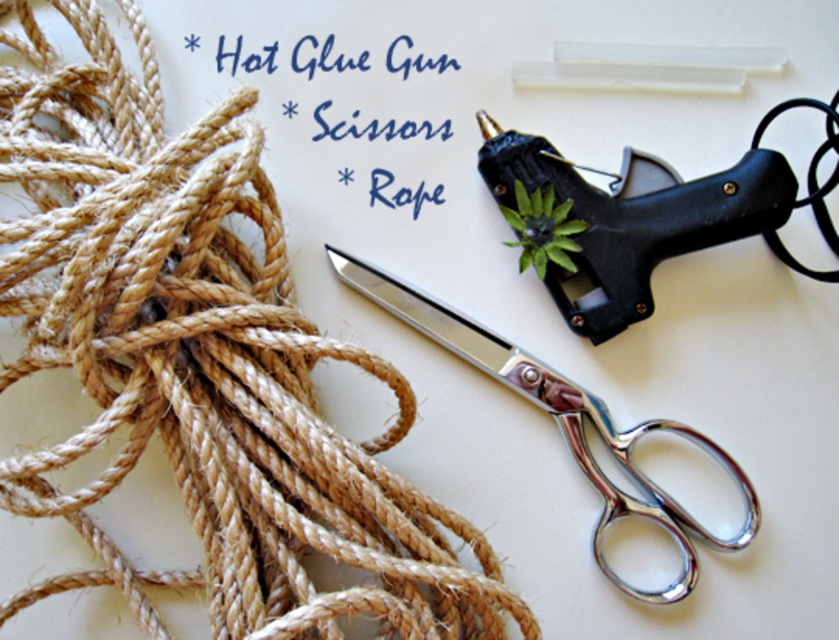
Question: Is polished metal scissors at center thinner than green leafy plant at upper center?

Choices:
 (A) no
 (B) yes

Answer: (A)

Question: From the image, what is the correct spatial relationship of matte black hot glue gun at upper right in relation to green leafy plant at upper center?

Choices:
 (A) left
 (B) right

Answer: (A)

Question: Is black plastic hot glue gun at upper right below matte black hot glue gun at upper right?

Choices:
 (A) yes
 (B) no

Answer: (A)

Question: Which point is closer to the camera taking this photo?

Choices:
 (A) (404, 72)
 (B) (576, 227)

Answer: (B)

Question: Which of these objects is positioned farthest from the black plastic hot glue gun at upper right?

Choices:
 (A) green leafy plant at upper center
 (B) matte black hot glue gun at upper right

Answer: (B)

Question: Which of the following is the closest to the observer?

Choices:
 (A) matte black hot glue gun at upper right
 (B) black plastic hot glue gun at upper right

Answer: (B)